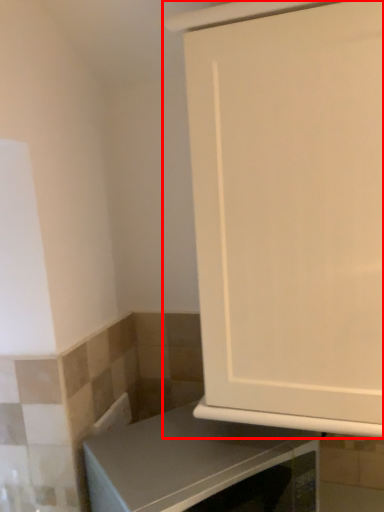
Question: In this image, where is cabinetry (annotated by the red box) located relative to countertop?

Choices:
 (A) left
 (B) right

Answer: (B)